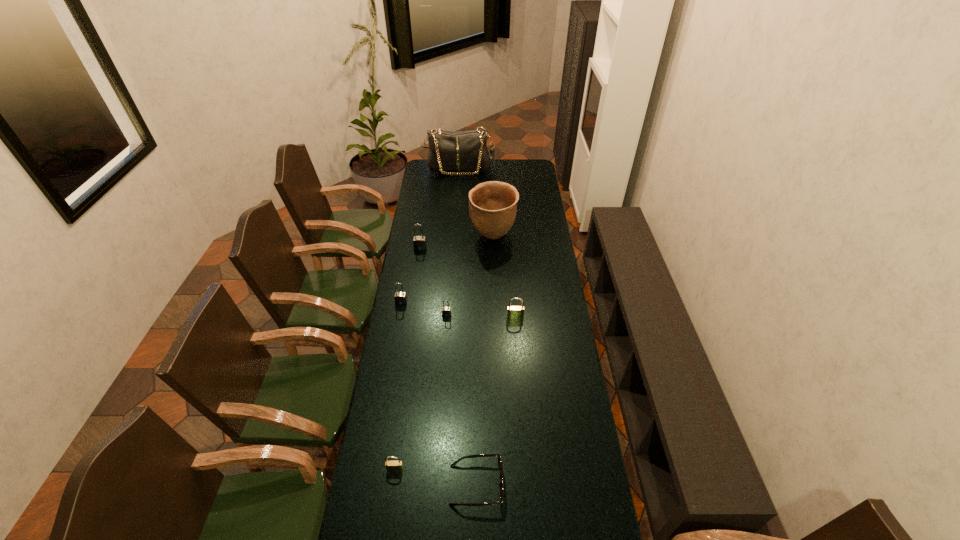
Locate which object ranks in proximity to the handbag. Please provide its 2D coordinates. Your answer should be formatted as a tuple, i.e. [(x, y)], where the tuple contains the x and y coordinates of a point satisfying the conditions above.

[(492, 205)]

Find the location of `padlock that is the closest to the smaller brass padlock`. padlock that is the closest to the smaller brass padlock is located at coordinates (446, 311).

Find the location of `padlock object that ranks as the closest to the nearer brass padlock`. padlock object that ranks as the closest to the nearer brass padlock is located at coordinates (446, 311).

Identify which gray padlock is the nearest to the second nearest gray padlock. Please provide its 2D coordinates. Your answer should be formatted as a tuple, i.e. [(x, y)], where the tuple contains the x and y coordinates of a point satisfying the conditions above.

[(446, 311)]

Identify which gray padlock is the nearest to the smaller brass padlock. Please provide its 2D coordinates. Your answer should be formatted as a tuple, i.e. [(x, y)], where the tuple contains the x and y coordinates of a point satisfying the conditions above.

[(446, 311)]

At what (x,y) coordinates should I click in order to perform the action: click on vacant space that satisfies the following two spatial constraints: 1. at the front of the pottery with chain and zipper; 2. on the left side of the handbag. Please return your answer as a coordinate pair (x, y). Looking at the image, I should click on (455, 237).

This screenshot has height=540, width=960. Find the location of `vacant position in the image that satisfies the following two spatial constraints: 1. at the front of the pottery with chain and zipper; 2. on the left side of the handbag`. vacant position in the image that satisfies the following two spatial constraints: 1. at the front of the pottery with chain and zipper; 2. on the left side of the handbag is located at coordinates (455, 237).